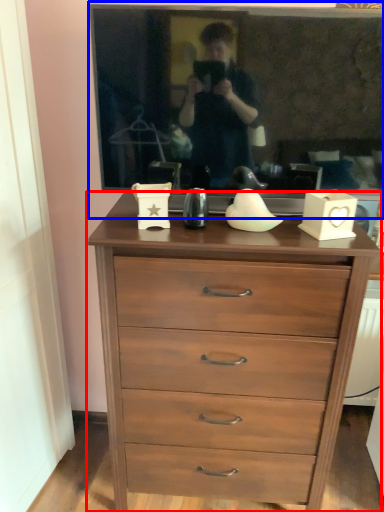
Question: Among these objects, which one is farthest to the camera, chest of drawers (highlighted by a red box) or picture frame (highlighted by a blue box)?

Choices:
 (A) chest of drawers
 (B) picture frame

Answer: (A)